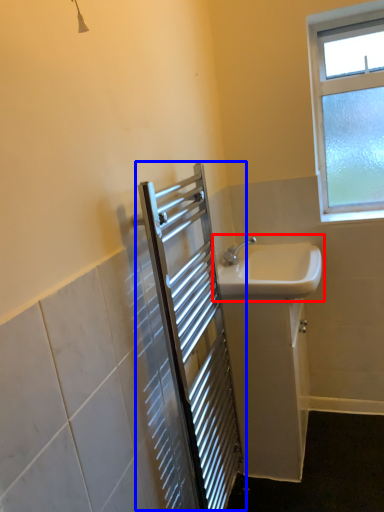
Question: Which point is closer to the camera, sink (highlighted by a red box) or screen door (highlighted by a blue box)?

Choices:
 (A) sink
 (B) screen door

Answer: (B)